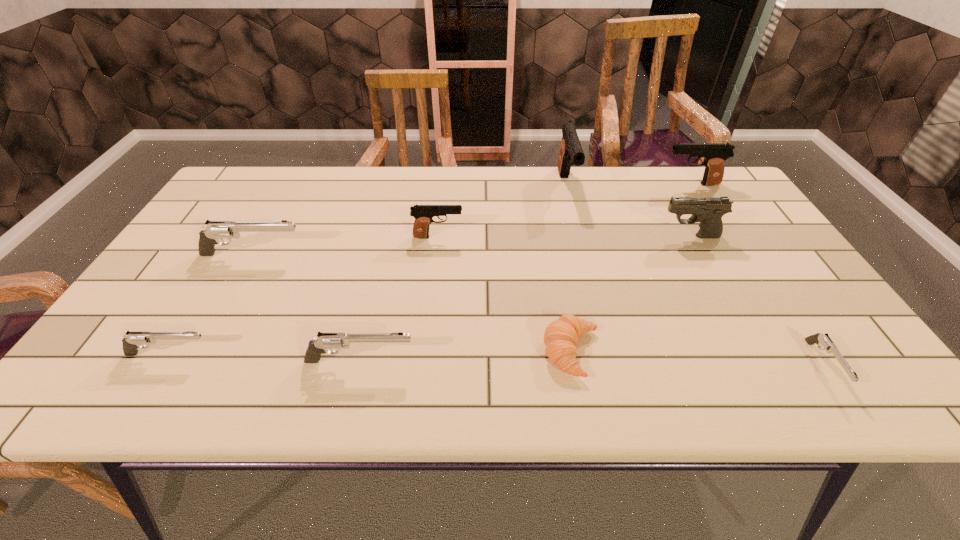
In order to click on the rightmost silver pistol in this screenshot , I will do `click(828, 345)`.

This screenshot has height=540, width=960. Identify the location of the smallest silver pistol. (828, 345).

The image size is (960, 540). Find the location of `blank space located at the barrel of the tallest object`. blank space located at the barrel of the tallest object is located at coordinates (578, 229).

Find the location of `vacant area situated 0.230m on the front-facing side of the farthest silver pistol`. vacant area situated 0.230m on the front-facing side of the farthest silver pistol is located at coordinates (394, 255).

The image size is (960, 540). What are the coordinates of `vacant space located at the barrel of the smallest black pistol` in the screenshot? It's located at (503, 237).

Locate an element on the screen. The width and height of the screenshot is (960, 540). vacant space located 0.170m on the front-facing side of the sixth tallest object is located at coordinates (497, 361).

I want to click on vacant space situated on the front-facing side of the seventh tallest pistol, so click(405, 354).

At what (x,y) coordinates should I click in order to perform the action: click on vacant space located on the right of the crescent roll. Please return your answer as a coordinate pair (x, y). This screenshot has height=540, width=960. Looking at the image, I should click on (662, 352).

Where is `crescent roll present at the near edge`? Image resolution: width=960 pixels, height=540 pixels. crescent roll present at the near edge is located at coordinates (561, 336).

Locate an element on the screen. This screenshot has height=540, width=960. object that is positioned at the far right corner is located at coordinates (715, 154).